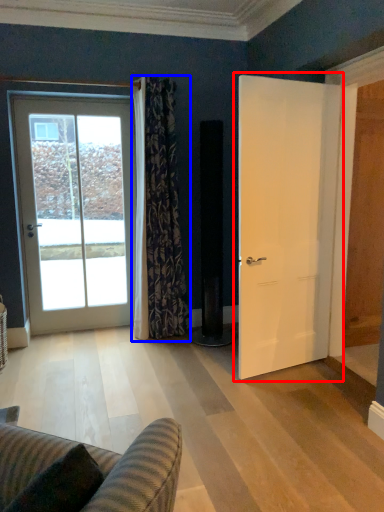
Question: Which object appears farthest to the camera in this image, door (highlighted by a red box) or curtain (highlighted by a blue box)?

Choices:
 (A) door
 (B) curtain

Answer: (B)